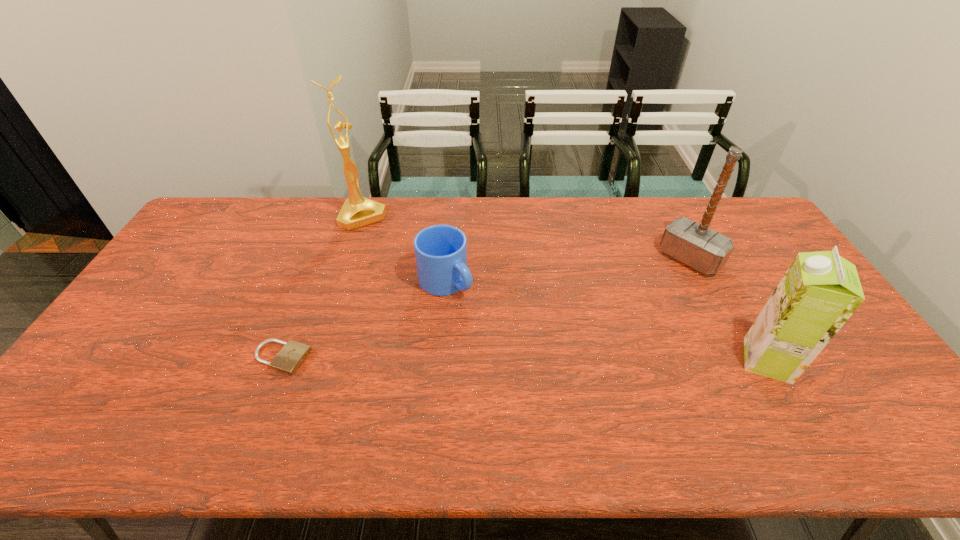
This screenshot has width=960, height=540. Identify the location of vacant space in between the mug and the hammer. (567, 271).

Where is `vacant region between the shortest object and the soya milk`? Image resolution: width=960 pixels, height=540 pixels. vacant region between the shortest object and the soya milk is located at coordinates (524, 359).

At what (x,y) coordinates should I click in order to perform the action: click on free space that is in between the hammer and the mug. Please return your answer as a coordinate pair (x, y). Looking at the image, I should click on (567, 271).

Locate an element on the screen. The height and width of the screenshot is (540, 960). free space that is in between the shortest object and the soya milk is located at coordinates (524, 359).

The image size is (960, 540). Identify the location of empty location between the third object from right to left and the hammer. (567, 271).

Locate which object ranks fourth in proximity to the third object from right to left. Please provide its 2D coordinates. Your answer should be formatted as a tuple, i.e. [(x, y)], where the tuple contains the x and y coordinates of a point satisfying the conditions above.

[(820, 291)]

Find the location of a particular element. the fourth closest object to the hammer is located at coordinates click(288, 360).

This screenshot has width=960, height=540. Find the location of `free space that satisfies the following two spatial constraints: 1. on the back side of the padlock; 2. on the right side of the hammer`. free space that satisfies the following two spatial constraints: 1. on the back side of the padlock; 2. on the right side of the hammer is located at coordinates point(321,259).

The height and width of the screenshot is (540, 960). I want to click on free spot that satisfies the following two spatial constraints: 1. on the back side of the mug; 2. on the left side of the shortest object, so click(x=311, y=282).

Where is `free region that satisfies the following two spatial constraints: 1. on the back side of the shortest object; 2. on the right side of the third object from left to right`? The height and width of the screenshot is (540, 960). free region that satisfies the following two spatial constraints: 1. on the back side of the shortest object; 2. on the right side of the third object from left to right is located at coordinates (311, 282).